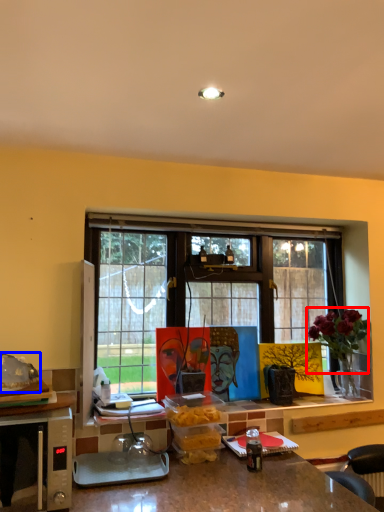
Question: Which object is further to the camera taking this photo, flower (highlighted by a red box) or food (highlighted by a blue box)?

Choices:
 (A) flower
 (B) food

Answer: (A)